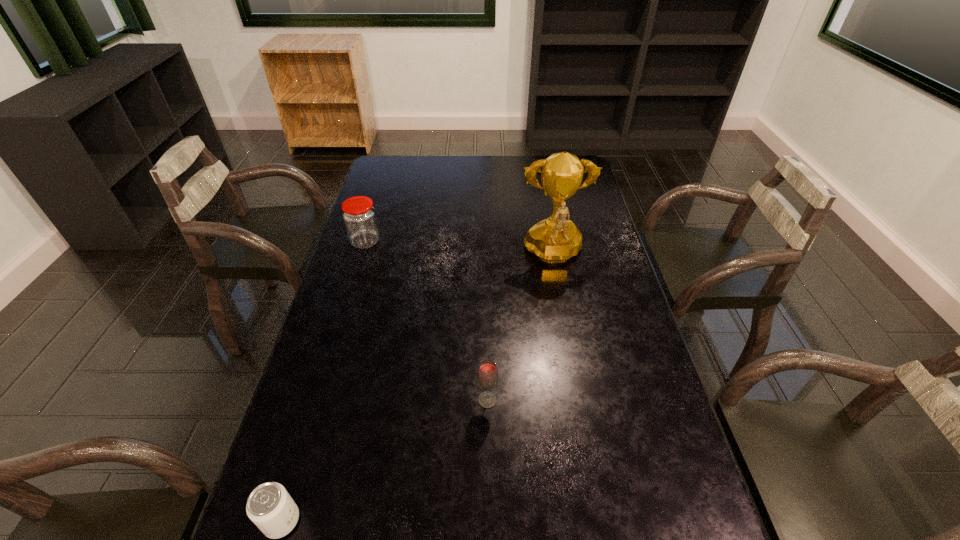
Identify the location of object that can be found as the second closest to the jar. This screenshot has width=960, height=540. [x=487, y=376].

I want to click on vacant point that satisfies the following two spatial constraints: 1. on the front side of the jar; 2. on the left side of the second nearest object, so click(317, 400).